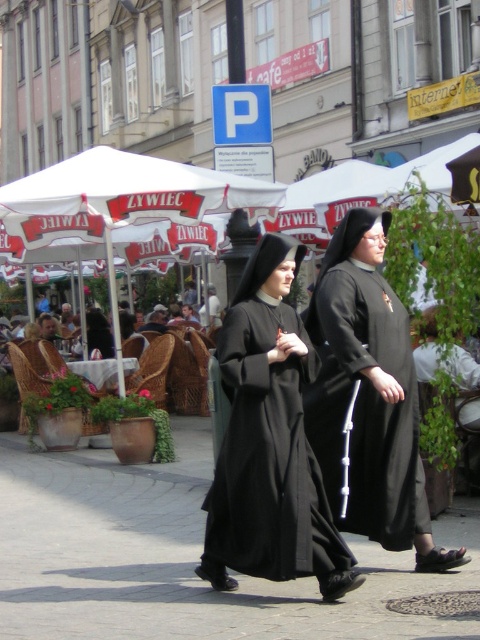
Is point (333, 289) closer to camera compared to point (406, 484)?

No, (333, 289) is behind (406, 484).

Does black matte nun's habit at center appear on the right side of black matte robe at center?

Yes, black matte nun's habit at center is to the right of black matte robe at center.

Which is in front, point (407, 316) or point (409, 356)?

Positioned in front is point (409, 356).

Locate an element on the screen. Image resolution: width=480 pixels, height=640 pixels. black matte nun's habit at center is located at coordinates (369, 396).

Is black matte nun's habit at center thinner than black matte dress at center?

Incorrect, black matte nun's habit at center's width is not less than black matte dress at center's.

Does black matte nun's habit at center appear over black matte dress at center?

Indeed, black matte nun's habit at center is positioned over black matte dress at center.

Does point (405, 541) come closer to viewer compared to point (311, 492)?

No, it is behind (311, 492).

Where is `black matte nun's habit at center`? This screenshot has width=480, height=640. black matte nun's habit at center is located at coordinates (369, 396).

Is black matte nun's habit at center below dark brown leather jacket at center?

Correct, black matte nun's habit at center is located below dark brown leather jacket at center.

Between point (385, 506) and point (213, 317), which one is positioned in front?

Positioned in front is point (385, 506).

Find the location of a particular element. black matte nun's habit at center is located at coordinates [369, 396].